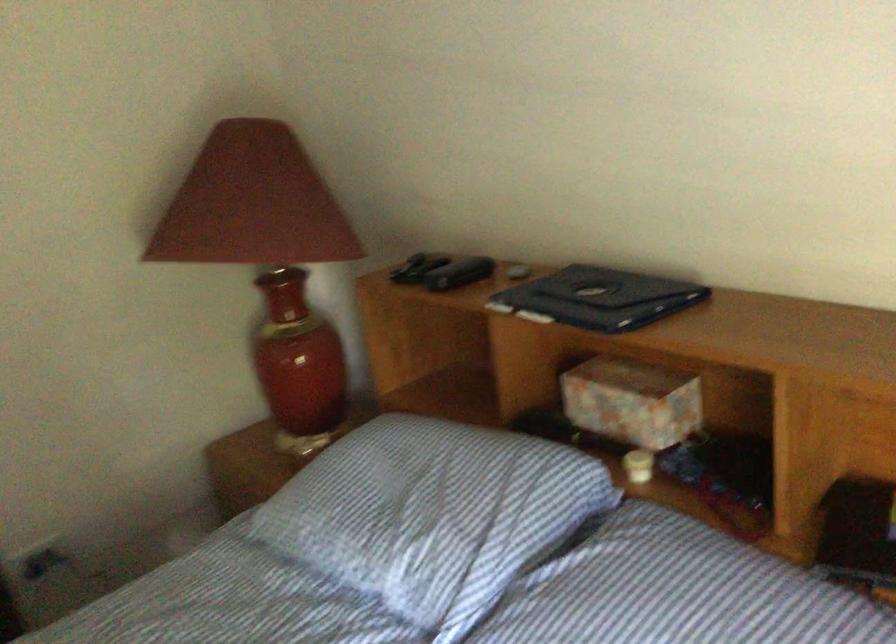
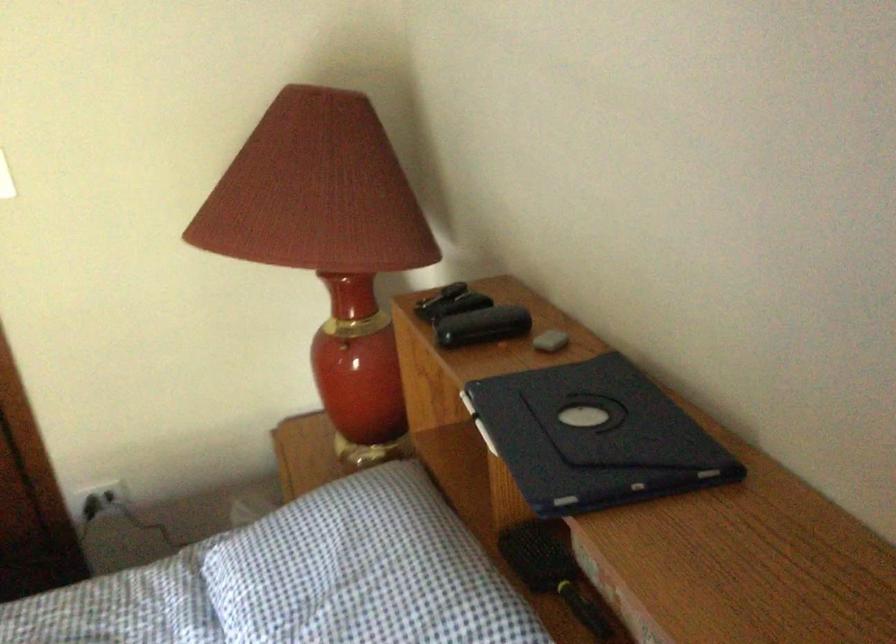
Find the pixel in the second image that matches point 563,433 in the first image.

(552, 571)